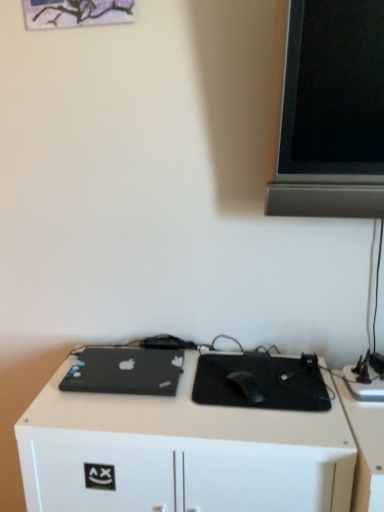
The image size is (384, 512). Identify the location of free space to the left of black matte mouse at center. (173, 403).